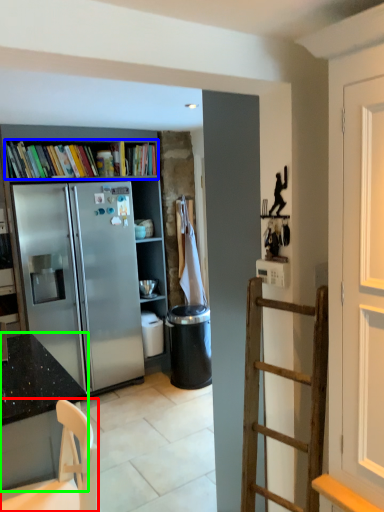
Question: Which object is the farthest from chair (highlighted by a red box)? Choose among these: book (highlighted by a blue box) or cabinetry (highlighted by a green box).

Choices:
 (A) book
 (B) cabinetry

Answer: (A)